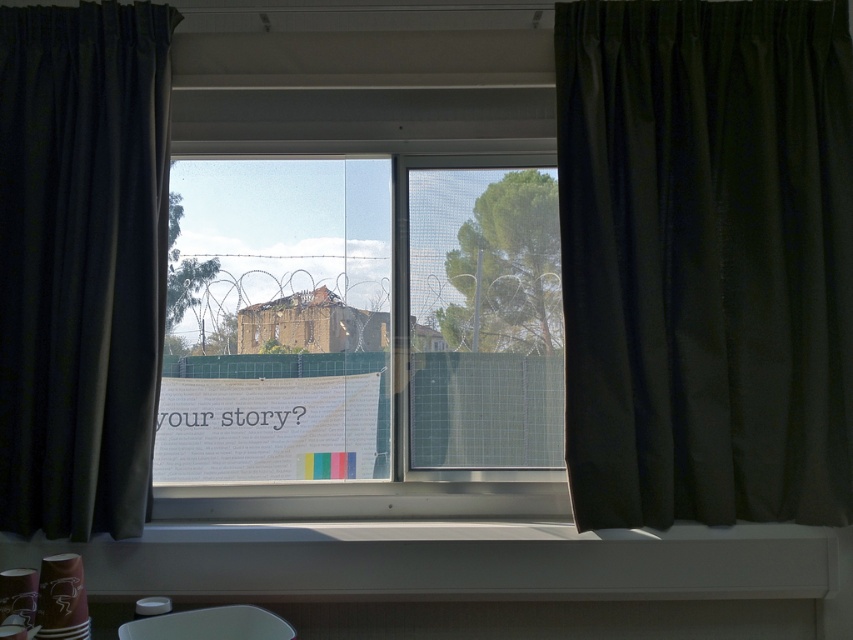
You are arranging flowers on the windowsill. You have a vase that needs to be placed in front of the black silk curtain at right. Can you place it on the white plastic window sill at lower center?

The white plastic window sill at lower center is behind the black silk curtain at right, so placing the vase on the white plastic window sill at lower center would place it behind the curtain, not in front of it. Therefore, you cannot place the vase on the white plastic window sill at lower center to have it in front of the black silk curtain at right.

You are a delivery robot with a package that is 60 centimeters wide. You need to place it on the white plastic window sill at lower center but there is a black silk curtain at right nearby. Will the package fit without touching the curtain?

The black silk curtain at right is 50.60 centimeters from the white plastic window sill at lower center. Since the package is 60 centimeters wide, it will extend beyond the space available and touch the curtain.

You are standing in the room looking at the window. Where is the black silk curtain at right located in terms of its 2D coordinates?

The black silk curtain at right is located at the 2D coordinates of point (706, 259).